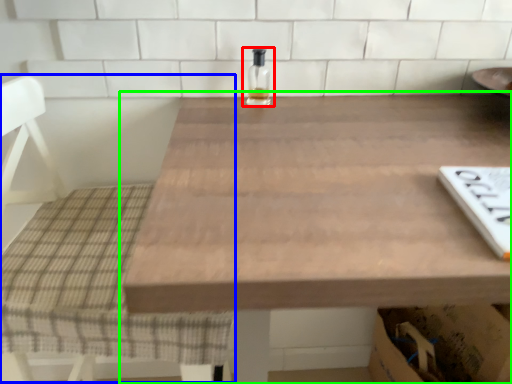
Question: Based on their relative distances, which object is nearer to bottle (highlighted by a red box)? Choose from chair (highlighted by a blue box) and table (highlighted by a green box).

Choices:
 (A) chair
 (B) table

Answer: (B)